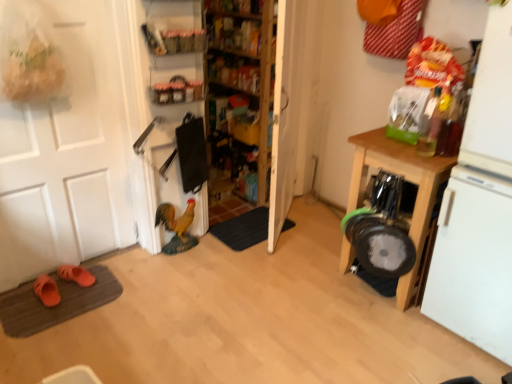
You are a GUI agent. You are given a task and a screenshot of the screen. Output one action in this format:
    pyautogui.click(x=<x>, y=<y>)
    Task: Click on the free location in front of dark gray carpet at center, which is the 2th doormat from left to right
    The width and height of the screenshot is (512, 384).
    Given the screenshot: What is the action you would take?
    pyautogui.click(x=226, y=268)